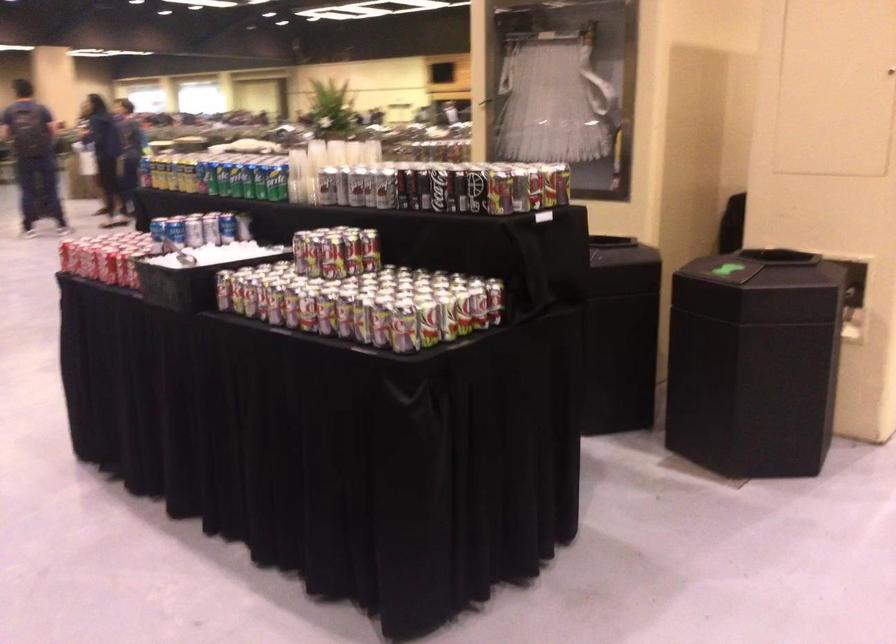
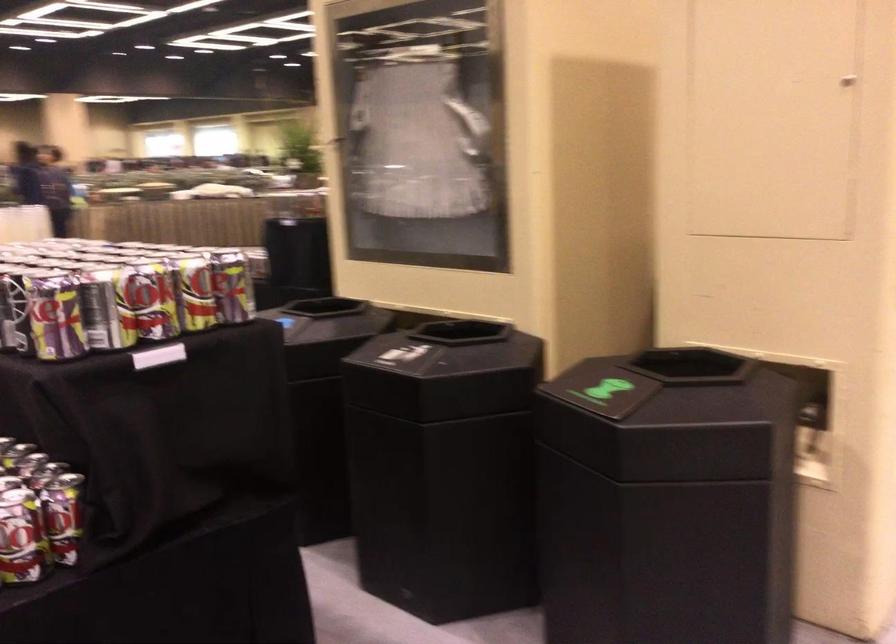
In the second image, find the point that corresponds to (x=543, y=174) in the first image.

(161, 299)